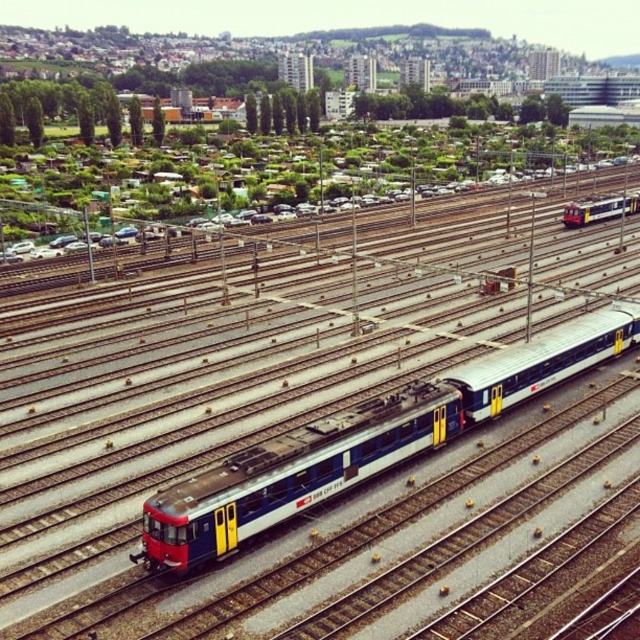
Question: Which of the following is the farthest from the observer?

Choices:
 (A) matte blue passenger train at center
 (B) matte blue train at center

Answer: (B)

Question: Does matte blue passenger train at center have a greater width compared to matte blue train at center?

Choices:
 (A) yes
 (B) no

Answer: (A)

Question: Is matte blue passenger train at center bigger than matte blue train at center?

Choices:
 (A) yes
 (B) no

Answer: (A)

Question: Is the position of matte blue passenger train at center more distant than that of matte blue train at center?

Choices:
 (A) no
 (B) yes

Answer: (A)